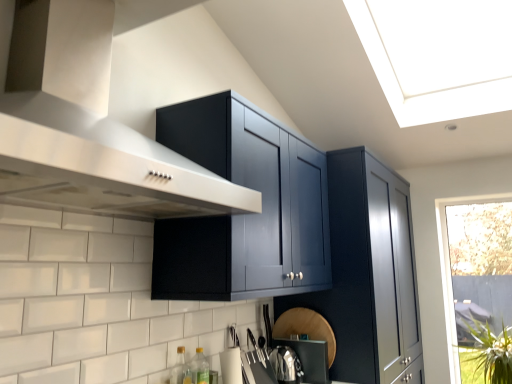
Question: Is green glass bottle at lower center, the second bottle positioned from the front, looking in the opposite direction of stainless steel vent at upper left?

Choices:
 (A) no
 (B) yes

Answer: (A)

Question: From a real-world perspective, is green glass bottle at lower center, the second bottle positioned from the front, below stainless steel vent at upper left?

Choices:
 (A) no
 (B) yes

Answer: (B)

Question: Is green glass bottle at lower center, the second bottle positioned from the front, aimed at stainless steel vent at upper left?

Choices:
 (A) no
 (B) yes

Answer: (A)

Question: Considering the relative sizes of green glass bottle at lower center, the second bottle positioned from the front, and stainless steel vent at upper left in the image provided, is green glass bottle at lower center, the second bottle positioned from the front, taller than stainless steel vent at upper left?

Choices:
 (A) no
 (B) yes

Answer: (A)

Question: Is green glass bottle at lower center, which is the 1th bottle from back to front, thinner than stainless steel vent at upper left?

Choices:
 (A) yes
 (B) no

Answer: (A)

Question: In terms of height, does transparent glass window at right look taller or shorter compared to green leafy plant at lower right?

Choices:
 (A) tall
 (B) short

Answer: (A)

Question: From the image's perspective, is transparent glass window at right located above or below green leafy plant at lower right?

Choices:
 (A) above
 (B) below

Answer: (A)

Question: From a real-world perspective, is transparent glass window at right physically located above or below green leafy plant at lower right?

Choices:
 (A) above
 (B) below

Answer: (A)

Question: Do you think transparent glass window at right is within green leafy plant at lower right, or outside of it?

Choices:
 (A) outside
 (B) inside

Answer: (A)

Question: From their relative heights in the image, would you say stainless steel vent at upper left is taller or shorter than translucent glass bottle at lower left, positioned as the 2th bottle in back-to-front order?

Choices:
 (A) short
 (B) tall

Answer: (B)

Question: From a real-world perspective, is stainless steel vent at upper left above or below translucent glass bottle at lower left, positioned as the 2th bottle in back-to-front order?

Choices:
 (A) below
 (B) above

Answer: (B)

Question: Visually, is stainless steel vent at upper left positioned to the left or to the right of translucent glass bottle at lower left, which appears as the first bottle when viewed from the front?

Choices:
 (A) right
 (B) left

Answer: (B)

Question: In the image, is stainless steel vent at upper left positioned in front of or behind translucent glass bottle at lower left, positioned as the 2th bottle in back-to-front order?

Choices:
 (A) behind
 (B) front

Answer: (B)

Question: Based on their positions, is green glass bottle at lower center, which is the 1th bottle from back to front, located to the left or right of green leafy plant at lower right?

Choices:
 (A) right
 (B) left

Answer: (B)

Question: Considering the positions of green glass bottle at lower center, which is the 1th bottle from back to front, and green leafy plant at lower right in the image, is green glass bottle at lower center, which is the 1th bottle from back to front, wider or thinner than green leafy plant at lower right?

Choices:
 (A) wide
 (B) thin

Answer: (B)